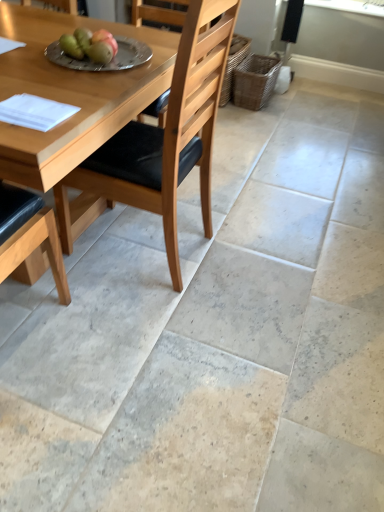
Find the location of `vacant area that lies to the right of green matte apple at upper left, acting as the 2th fruit starting from the right`. vacant area that lies to the right of green matte apple at upper left, acting as the 2th fruit starting from the right is located at coordinates (130, 66).